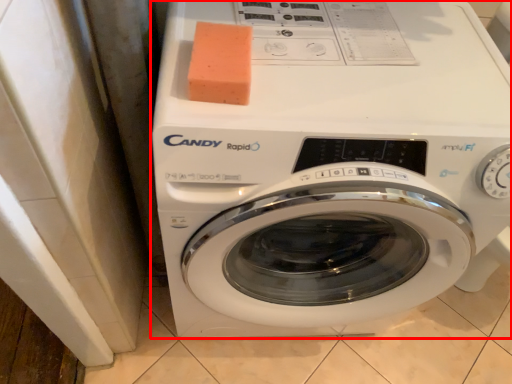
Question: From the image's perspective, what is the correct spatial relationship of washing machine (annotated by the red box) in relation to soap?

Choices:
 (A) above
 (B) below

Answer: (B)